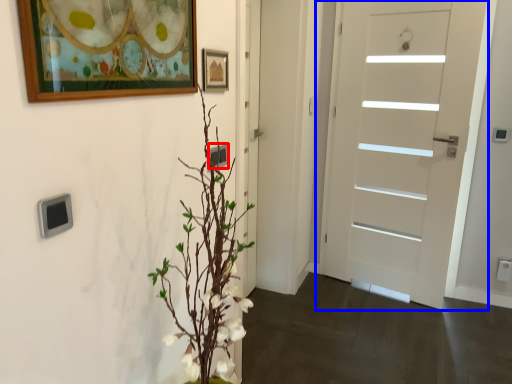
Question: Which of the following is the closest to the observer, electric outlet (highlighted by a red box) or door (highlighted by a blue box)?

Choices:
 (A) electric outlet
 (B) door

Answer: (A)